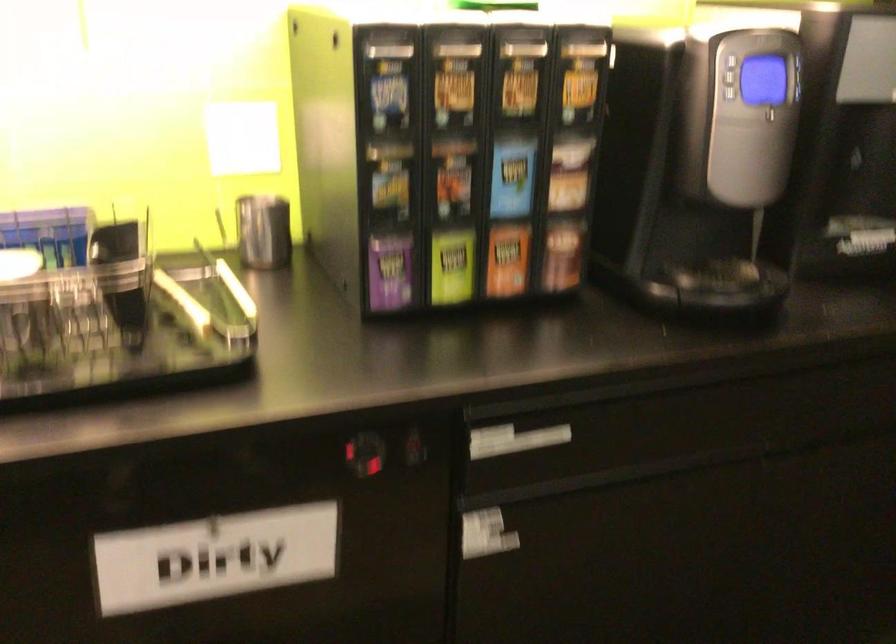
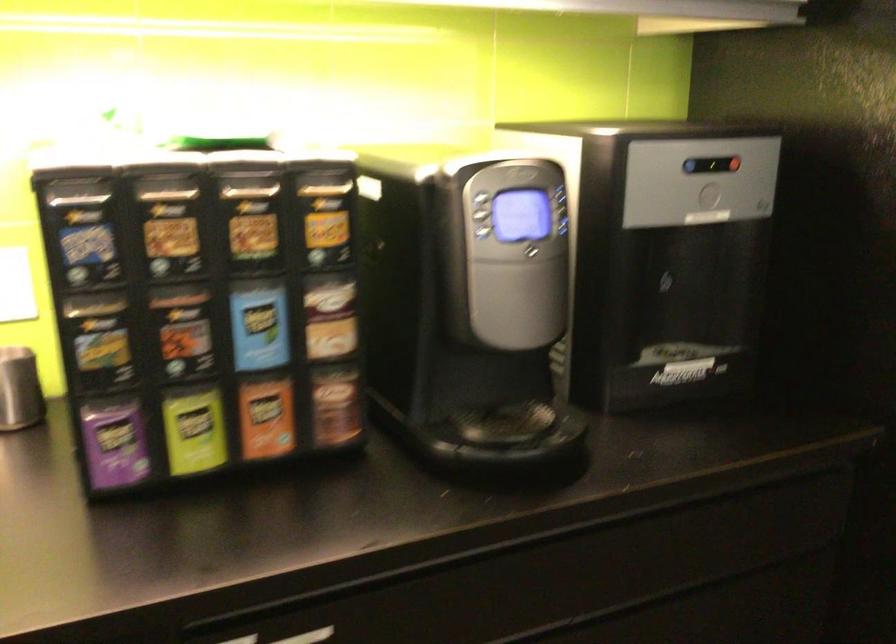
Where in the second image is the point corresponding to point (771, 115) from the first image?

(533, 252)